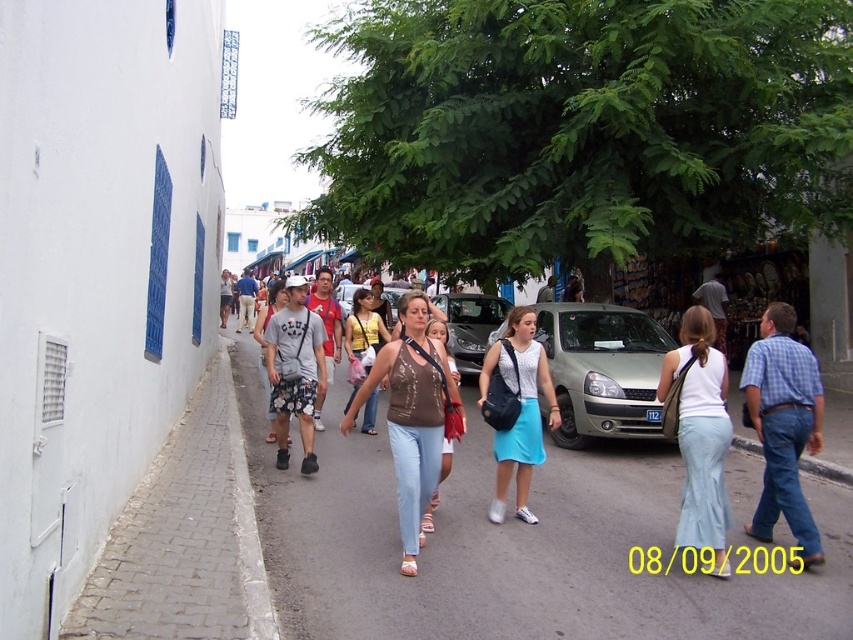
Is brown shiny tank top at center below brown leather purse at center?

Actually, brown shiny tank top at center is above brown leather purse at center.

You are a GUI agent. You are given a task and a screenshot of the screen. Output one action in this format:
    pyautogui.click(x=<x>, y=<y>)
    Task: Click on the brown shiny tank top at center
    This screenshot has width=853, height=640.
    Given the screenshot: What is the action you would take?
    pyautogui.click(x=413, y=417)

Locate an element on the screen. The height and width of the screenshot is (640, 853). brown shiny tank top at center is located at coordinates (413, 417).

From the picture: Is light blue skirt at center closer to the viewer compared to matte brown tank top at center?

Yes, it is.

Between light blue skirt at center and matte brown tank top at center, which one appears on the left side from the viewer's perspective?

From the viewer's perspective, matte brown tank top at center appears more on the left side.

Is point (503, 438) farther from camera compared to point (375, 403)?

No, it is not.

The image size is (853, 640). I want to click on light blue skirt at center, so click(x=515, y=408).

Who is taller, brown shiny tank top at center or white cotton skirt at center?

brown shiny tank top at center

Can you confirm if brown shiny tank top at center is positioned to the right of white cotton skirt at center?

No, brown shiny tank top at center is not to the right of white cotton skirt at center.

This screenshot has width=853, height=640. Identify the location of brown shiny tank top at center. (413, 417).